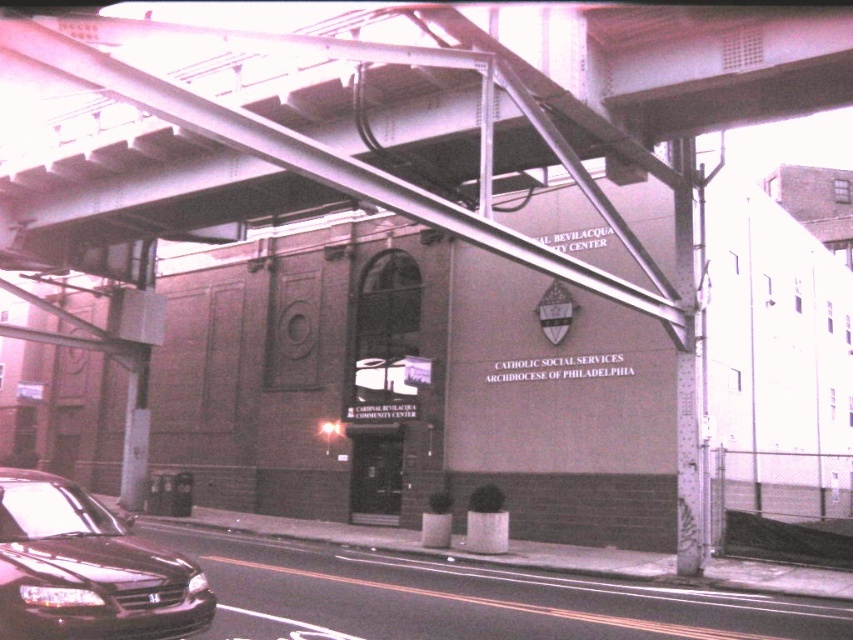
Is metal at upper center positioned at the back of shiny black sedan at lower left?

Yes, it is behind shiny black sedan at lower left.

In the scene shown: Is metal at upper center shorter than shiny black sedan at lower left?

Yes.

Looking at this image, measure the distance between metal at upper center and camera.

metal at upper center and camera are 10.86 meters apart.

Image resolution: width=853 pixels, height=640 pixels. Find the location of `metal at upper center`. metal at upper center is located at coordinates (689, 72).